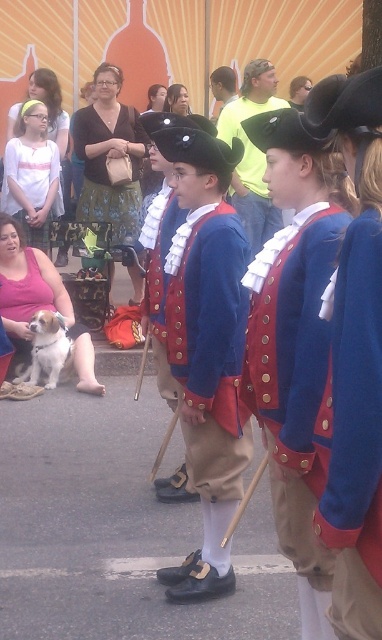
In the scene shown: In the historical reenactment scene, you see a blue woolen vest at center and a white fur dog at lower left. Which object is closer to the viewer?

The blue woolen vest at center is closer to the viewer because it is in front of the white fur dog at lower left.

You are a costume designer observing the historical reenactment scene. You need to determine which of the two garments, the matte blue fabric vest at center or the matte yellow shirt at center, would be more suitable for a character requiring a thinner garment. Based on the scene description, which garment should you choose?

The matte blue fabric vest at center is thinner than the matte yellow shirt at center, so the matte blue fabric vest at center would be more suitable for the character requiring a thinner garment.